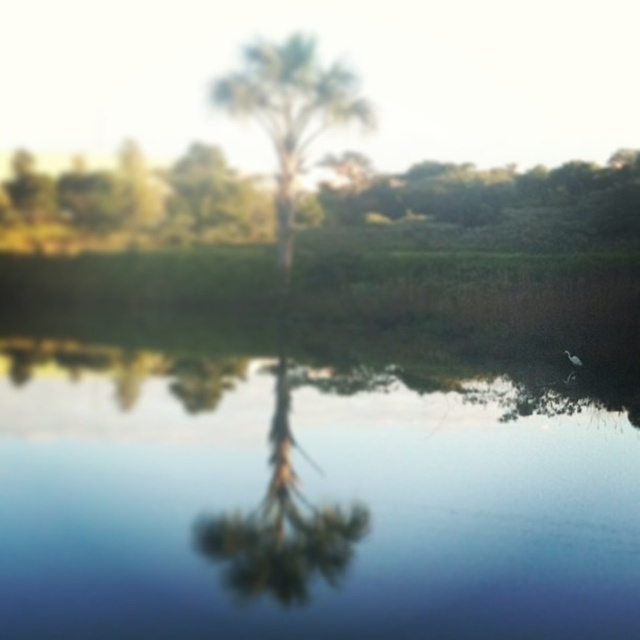
Question: Estimate the real-world distances between objects in this image. Which object is farther from the transparent blue water at center?

Choices:
 (A) green matte tree at center
 (B) green leafy tree at center

Answer: (B)

Question: Which object is positioned farthest from the green matte tree at center?

Choices:
 (A) transparent blue water at center
 (B) green leafy tree at center

Answer: (B)

Question: Which of the following is the closest to the observer?

Choices:
 (A) (262, 576)
 (B) (314, 81)
 (C) (570, 470)

Answer: (A)

Question: Observing the image, what is the correct spatial positioning of transparent blue water at center in reference to green leafy tree at center?

Choices:
 (A) below
 (B) above

Answer: (A)

Question: Is transparent blue water at center thinner than green matte tree at center?

Choices:
 (A) yes
 (B) no

Answer: (B)

Question: Can you confirm if green matte tree at center is positioned below green leafy tree at center?

Choices:
 (A) yes
 (B) no

Answer: (A)